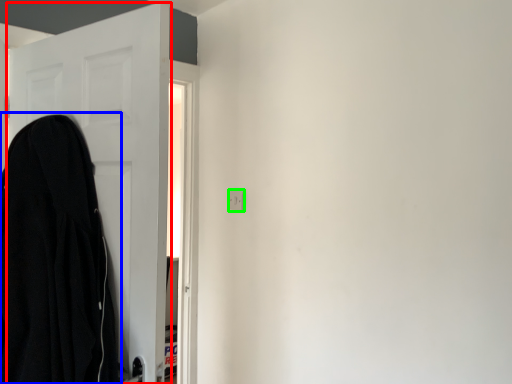
Question: Considering the real-world distances, which object is closest to door (highlighted by a red box)? cloak (highlighted by a blue box) or electric outlet (highlighted by a green box).

Choices:
 (A) cloak
 (B) electric outlet

Answer: (A)